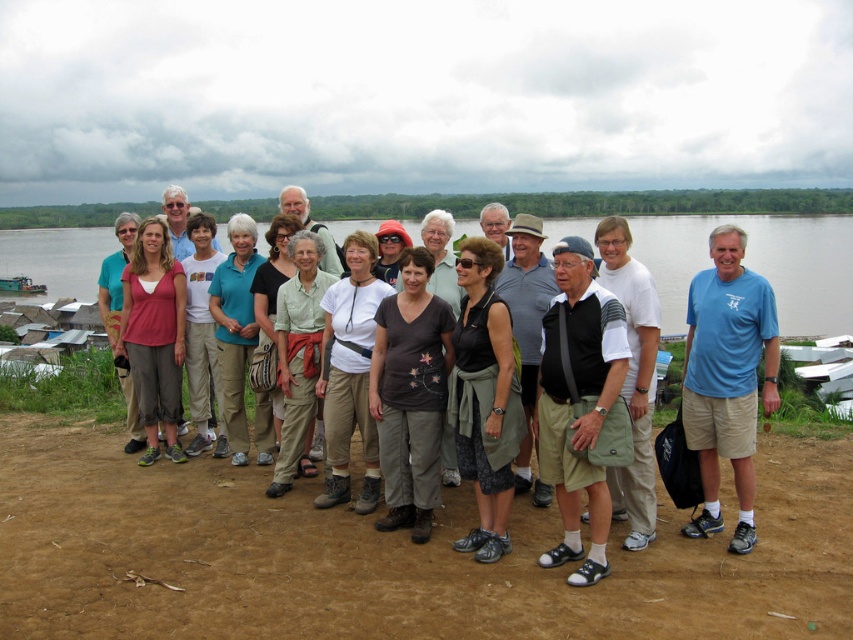
You are a photographer trying to capture a photo of the clear water at center and the brown fabric pants at center. Which object appears taller in the photo?

The clear water at center appears taller than the brown fabric pants at center in the photo.